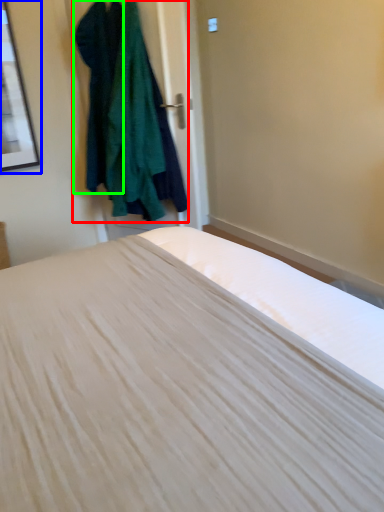
Question: Estimate the real-world distances between objects in this image. Which object is farther from clothing (highlighted by a red box), picture frame (highlighted by a blue box) or clothing (highlighted by a green box)?

Choices:
 (A) picture frame
 (B) clothing

Answer: (A)